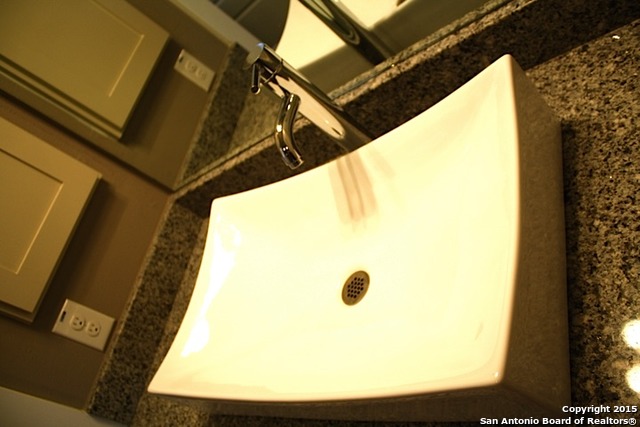
The height and width of the screenshot is (427, 640). What are the coordinates of `faucet` in the screenshot? It's located at (314, 104).